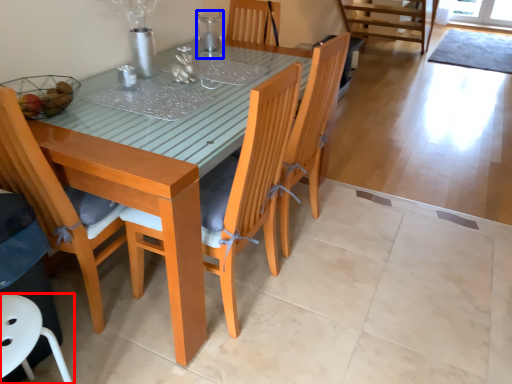
Question: Which point is closer to the camera, chair (highlighted by a red box) or tableware (highlighted by a blue box)?

Choices:
 (A) chair
 (B) tableware

Answer: (A)